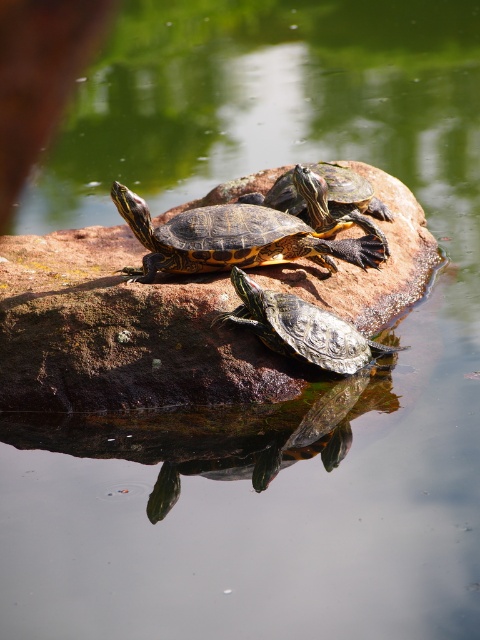
You are a photographer trying to capture the reflection of the shiny green tortoise at center in the water. Based on the coordinates provided, where should you aim your camera to ensure the reflection is centered in your shot?

To capture the reflection of the shiny green tortoise at center, aim your camera at the coordinates provided in the water, which are the same as the turtle but mirrored vertically. Since the turtle is at point (300, 328), its reflection would be at approximately (179, 328). Position your camera to center this mirrored point for the reflection to appear centered in your shot.

You are a nature photographer aiming to capture the turtles in the scene. You need to know which turtle is closer to the water surface so you can adjust your camera angle. Which turtle, the patterned shell turtle at center or the shiny brown tortoise at center, is positioned lower?

The patterned shell turtle at center is shorter than the shiny brown tortoise at center, so the patterned shell turtle at center is positioned lower and closer to the water surface.

You are a photographer trying to capture the patterned shell turtle at center in the image. Based on its 2D coordinates, where should you aim your camera to ensure the turtle is centered in your shot?

The patterned shell turtle at center is located at the 2D coordinates point (x=247, y=234), so you should aim your camera at that point to center it in your shot.